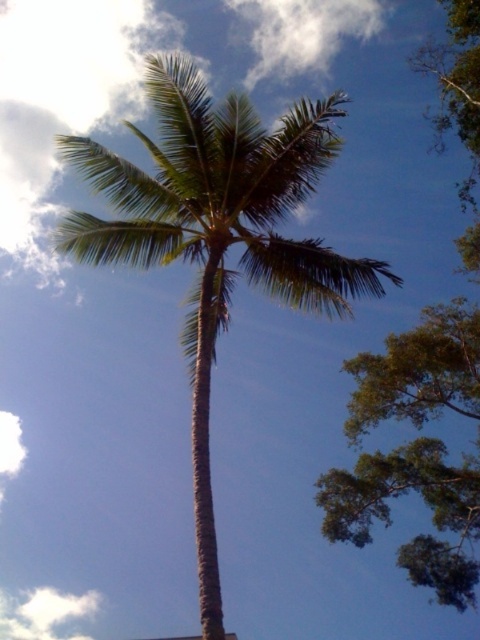
Is green leafy coconut tree at center shorter than green leafy palm at upper left?

Correct, green leafy coconut tree at center is not as tall as green leafy palm at upper left.

Which is more to the right, green leafy coconut tree at center or green leafy palm at upper left?

Positioned to the right is green leafy palm at upper left.

Does point (126, 211) lie behind point (476, 99)?

No.

Where is `green leafy coconut tree at center`? The width and height of the screenshot is (480, 640). green leafy coconut tree at center is located at coordinates click(216, 234).